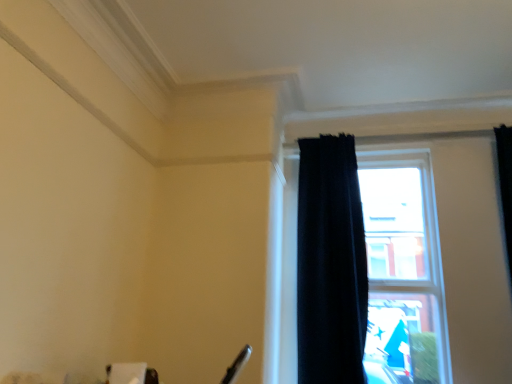
Question: Considering the positions of black curtain at right and black velvet curtain at right in the image, is black curtain at right taller or shorter than black velvet curtain at right?

Choices:
 (A) short
 (B) tall

Answer: (A)

Question: From a real-world perspective, is black curtain at right above or below black velvet curtain at right?

Choices:
 (A) below
 (B) above

Answer: (A)

Question: Considering the positions of black curtain at right and black velvet curtain at right in the image, is black curtain at right bigger or smaller than black velvet curtain at right?

Choices:
 (A) big
 (B) small

Answer: (A)

Question: In terms of width, does black velvet curtain at right look wider or thinner when compared to black curtain at right?

Choices:
 (A) wide
 (B) thin

Answer: (A)

Question: In the image, is black velvet curtain at right on the left side or the right side of black curtain at right?

Choices:
 (A) left
 (B) right

Answer: (A)

Question: From the image's perspective, is black velvet curtain at right located above or below black curtain at right?

Choices:
 (A) below
 (B) above

Answer: (B)

Question: Relative to black curtain at right, is black velvet curtain at right in front or behind?

Choices:
 (A) behind
 (B) front

Answer: (B)